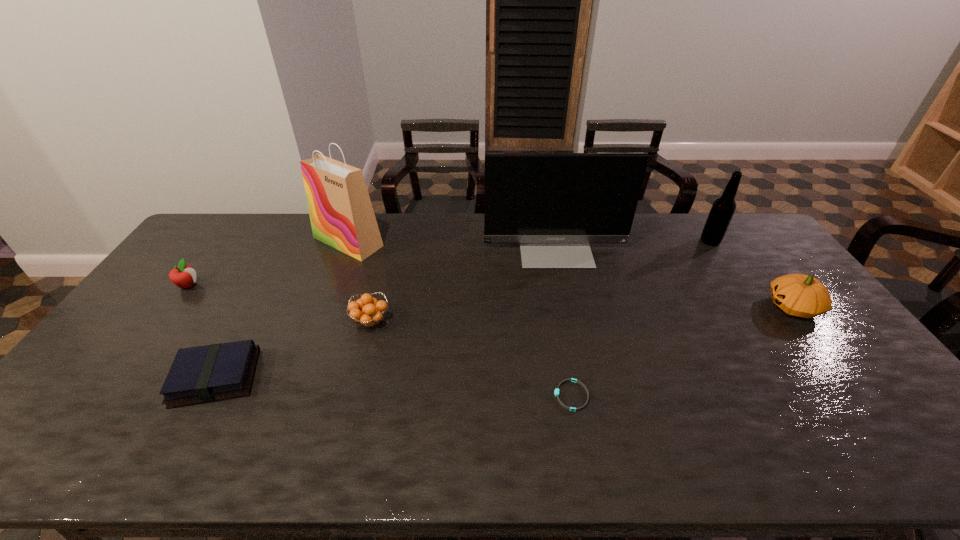
Find the location of a particular element. free space at the near edge of the desktop is located at coordinates (584, 460).

In the image, there is a desktop. Where is `free region at the left edge`? This screenshot has height=540, width=960. free region at the left edge is located at coordinates (108, 354).

At what (x,y) coordinates should I click in order to perform the action: click on vacant space at the right edge of the desktop. Please return your answer as a coordinate pair (x, y). The height and width of the screenshot is (540, 960). Looking at the image, I should click on (816, 345).

In order to click on free spot between the shopping bag and the computer monitor in this screenshot , I will do `click(451, 244)`.

Locate an element on the screen. This screenshot has height=540, width=960. unoccupied position between the shopping bag and the computer monitor is located at coordinates (451, 244).

This screenshot has height=540, width=960. Identify the location of free spot between the orange fruit and the third tallest object. pos(540,281).

Where is `vacant space in between the seventh object from left to right and the rightmost object`? The image size is (960, 540). vacant space in between the seventh object from left to right and the rightmost object is located at coordinates (752, 274).

Where is `blank region between the shopping bag and the wristband`? blank region between the shopping bag and the wristband is located at coordinates (460, 319).

The width and height of the screenshot is (960, 540). What are the coordinates of `free space between the orange fruit and the shopping bag` in the screenshot? It's located at (359, 281).

Locate an element on the screen. free point between the second object from right to left and the book is located at coordinates (463, 309).